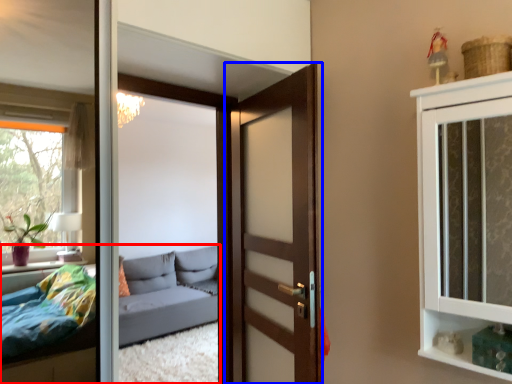
Question: Among these objects, which one is nearest to the camera, studio couch (highlighted by a red box) or door (highlighted by a blue box)?

Choices:
 (A) studio couch
 (B) door

Answer: (B)